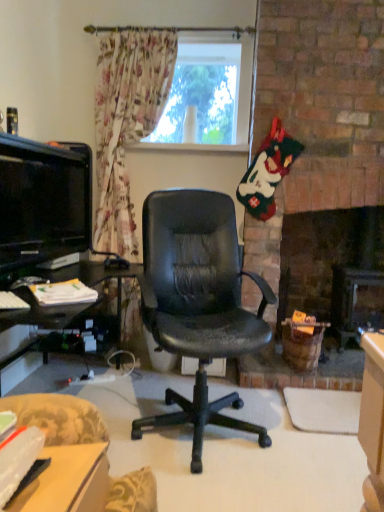
This screenshot has height=512, width=384. What do you see at coordinates (207, 95) in the screenshot?
I see `transparent glass window at upper center` at bounding box center [207, 95].

At what (x,y) coordinates should I click in order to perform the action: click on transparent glass window at upper center. Please return your answer as a coordinate pair (x, y). This screenshot has height=512, width=384. Looking at the image, I should click on (207, 95).

The width and height of the screenshot is (384, 512). Describe the element at coordinates (43, 201) in the screenshot. I see `matte black tv at left` at that location.

Image resolution: width=384 pixels, height=512 pixels. Find the location of `transparent glass window at upper center`. transparent glass window at upper center is located at coordinates (207, 95).

Could you tell me if matte plastic desk at lower left is turned towards matte black tv at left?

No, matte plastic desk at lower left is not oriented towards matte black tv at left.

From the image's perspective, is matte plastic desk at lower left above or below matte black tv at left?

Clearly, from the image's perspective, matte plastic desk at lower left is below matte black tv at left.

Does matte plastic desk at lower left have a larger size compared to matte black tv at left?

No.

Identify the location of desk on the left side of transparent glass window at upper center. This screenshot has width=384, height=512. (68, 481).

Based on the photo, considering the relative sizes of matte plastic desk at lower left and transparent glass window at upper center in the image provided, is matte plastic desk at lower left smaller than transparent glass window at upper center?

Correct, matte plastic desk at lower left occupies less space than transparent glass window at upper center.

Considering the relative sizes of matte plastic desk at lower left and transparent glass window at upper center in the image provided, is matte plastic desk at lower left taller than transparent glass window at upper center?

No, matte plastic desk at lower left is not taller than transparent glass window at upper center.

Which is behind, matte plastic desk at lower left or transparent glass window at upper center?

transparent glass window at upper center is behind.

From a real-world perspective, between matte black tv at left and matte plastic desk at lower left, who is vertically higher?

In real-world perspective, matte black tv at left is above.

Is matte black tv at left far from matte plastic desk at lower left?

matte black tv at left is far away from matte plastic desk at lower left.

Which of these two, matte black tv at left or matte plastic desk at lower left, is thinner?

matte black tv at left.

Is matte black tv at left turned away from matte plastic desk at lower left?

matte black tv at left is not turned away from matte plastic desk at lower left.

Find the location of `window that appears behind the matte black tv at left`. window that appears behind the matte black tv at left is located at coordinates (207, 95).

Does transparent glass window at upper center have a greater height compared to matte black tv at left?

Correct, transparent glass window at upper center is much taller as matte black tv at left.

Is point (224, 94) in front of point (29, 201)?

No, it is not.

Considering the relative positions of transparent glass window at upper center and matte black tv at left in the image provided, is transparent glass window at upper center to the left or to the right of matte black tv at left?

transparent glass window at upper center is positioned on matte black tv at left's right side.

Is matte black tv at left turned away from transparent glass window at upper center?

matte black tv at left is not turned away from transparent glass window at upper center.

Who is bigger, matte black tv at left or transparent glass window at upper center?

transparent glass window at upper center is bigger.

You are a GUI agent. You are given a task and a screenshot of the screen. Output one action in this format:
    pyautogui.click(x=<x>, y=<y>)
    Task: Click on the television on the left side of transparent glass window at upper center
    
    Given the screenshot: What is the action you would take?
    pyautogui.click(x=43, y=201)

How distant is matte black tv at left from transparent glass window at upper center?

They are 35.92 inches apart.

What's the angular difference between transparent glass window at upper center and matte plastic desk at lower left's facing directions?

There is a 92.7-degree angle between the facing directions of transparent glass window at upper center and matte plastic desk at lower left.

How much distance is there between transparent glass window at upper center and matte plastic desk at lower left?

The distance of transparent glass window at upper center from matte plastic desk at lower left is 7.87 feet.

Based on their positions, is transparent glass window at upper center located to the left or right of matte plastic desk at lower left?

Based on their positions, transparent glass window at upper center is located to the right of matte plastic desk at lower left.

Looking at this image, which object is thinner, transparent glass window at upper center or matte plastic desk at lower left?

transparent glass window at upper center is thinner.

Where is `television located on the left of matte plastic desk at lower left`? This screenshot has width=384, height=512. television located on the left of matte plastic desk at lower left is located at coordinates (43, 201).

Where is `desk below the transparent glass window at upper center (from a real-world perspective)`? The image size is (384, 512). desk below the transparent glass window at upper center (from a real-world perspective) is located at coordinates (68, 481).

Based on the photo, based on their spatial positions, is matte black tv at left or matte plastic desk at lower left closer to transparent glass window at upper center?

Based on the image, matte black tv at left appears to be nearer to transparent glass window at upper center.

Based on their spatial positions, is matte plastic desk at lower left or transparent glass window at upper center closer to matte black tv at left?

transparent glass window at upper center is closer to matte black tv at left.

From the picture: Looking at the image, which one is located closer to matte plastic desk at lower left, matte black tv at left or transparent glass window at upper center?

Based on the image, matte black tv at left appears to be nearer to matte plastic desk at lower left.

Estimate the real-world distances between objects in this image. Which object is further from matte plastic desk at lower left, transparent glass window at upper center or matte black tv at left?

transparent glass window at upper center.

From the image, which object appears to be farther from matte black tv at left, transparent glass window at upper center or matte plastic desk at lower left?

matte plastic desk at lower left.

Which object lies nearer to the anchor point transparent glass window at upper center, matte plastic desk at lower left or matte black tv at left?

matte black tv at left lies closer to transparent glass window at upper center than the other object.

I want to click on television between matte plastic desk at lower left and transparent glass window at upper center in the front-back direction, so click(43, 201).